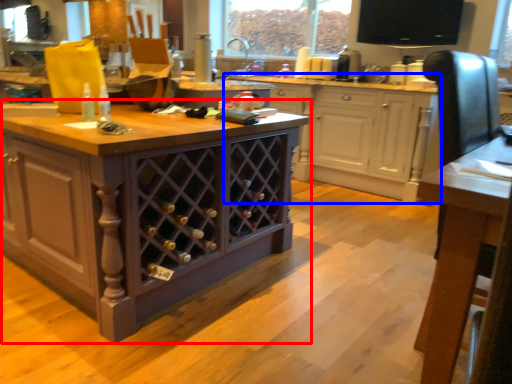
Question: Which object is further to the camera taking this photo, cabinetry (highlighted by a red box) or cabinetry (highlighted by a blue box)?

Choices:
 (A) cabinetry
 (B) cabinetry

Answer: (B)